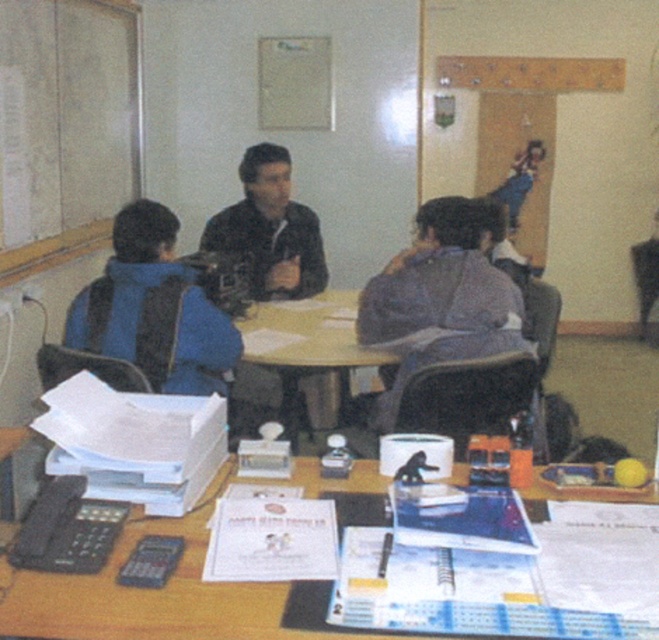
You are organizing a clothing donation drive and need to categorize jackets based on their size. You see the blue fabric jacket at left and the black matte jacket at center. Which jacket should you place in the large size bin?

The blue fabric jacket at left should be placed in the large size bin since it is larger in size than the black matte jacket at center.

You are organizing a workshop and need to arrange chairs for participants. The chairs are 40 cm wide. You have two jackets on the table, the blue fabric jacket at left and the black matte jacket at center. Which jacket can you place on a chair without overlapping the edges?

The black matte jacket at center can be placed on a chair without overlapping the edges because its width is smaller than the blue fabric jacket at left, and the chair is 40 cm wide.